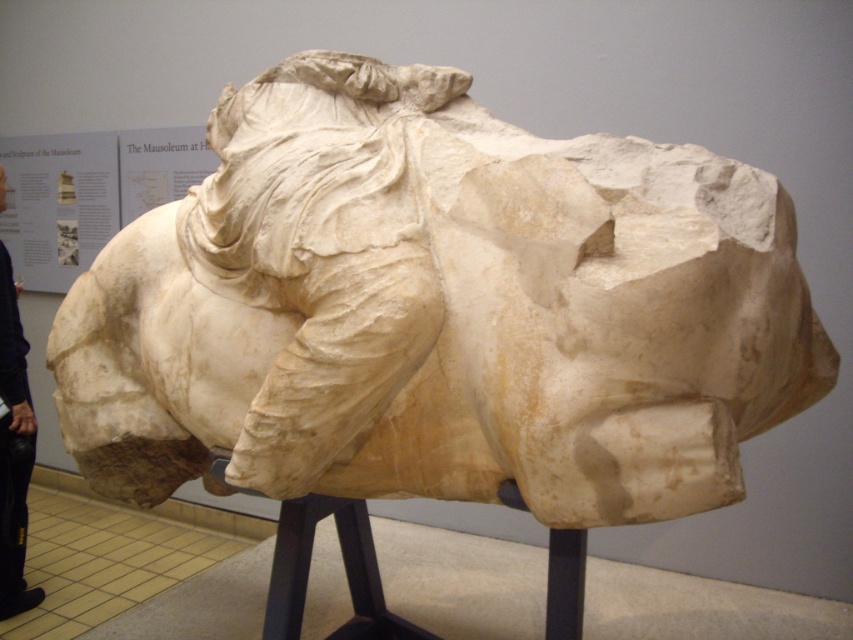
Question: Which object appears farthest from the camera in this image?

Choices:
 (A) black leather pants at lower left
 (B) white marble horse at center

Answer: (A)

Question: Can you confirm if white marble horse at center is positioned to the left of black leather pants at lower left?

Choices:
 (A) no
 (B) yes

Answer: (A)

Question: Is white marble horse at center thinner than black leather pants at lower left?

Choices:
 (A) no
 (B) yes

Answer: (A)

Question: Where is white marble horse at center located in relation to black leather pants at lower left in the image?

Choices:
 (A) left
 (B) right

Answer: (B)